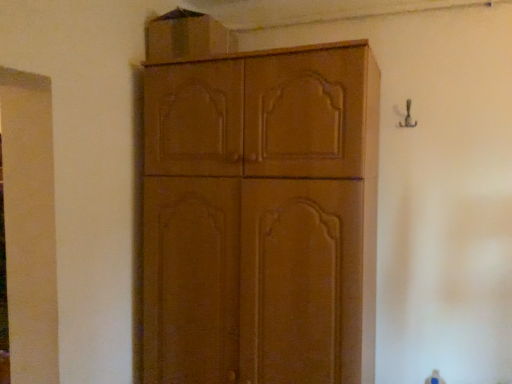
Question: In terms of height, does matte wood cabinet at center, the second cabinetry in the top-to-bottom sequence, look taller or shorter compared to matte brown cabinet at upper center, which is counted as the first cabinetry, starting from the top?

Choices:
 (A) tall
 (B) short

Answer: (A)

Question: Based on their sizes in the image, would you say matte wood cabinet at center, the second cabinetry in the top-to-bottom sequence, is bigger or smaller than matte brown cabinet at upper center, acting as the second cabinetry starting from the bottom?

Choices:
 (A) small
 (B) big

Answer: (B)

Question: From the image's perspective, is matte wood cabinet at center, the second cabinetry in the top-to-bottom sequence, positioned above or below matte brown cabinet at upper center, which is counted as the first cabinetry, starting from the top?

Choices:
 (A) below
 (B) above

Answer: (A)

Question: Is matte brown cabinet at upper center, acting as the second cabinetry starting from the bottom, to the left or to the right of matte wood cabinet at center, positioned as the 1th cabinetry in bottom-to-top order, in the image?

Choices:
 (A) right
 (B) left

Answer: (B)

Question: Considering the positions of matte brown cabinet at upper center, acting as the second cabinetry starting from the bottom, and matte wood cabinet at center, positioned as the 1th cabinetry in bottom-to-top order, in the image, is matte brown cabinet at upper center, acting as the second cabinetry starting from the bottom, wider or thinner than matte wood cabinet at center, positioned as the 1th cabinetry in bottom-to-top order,?

Choices:
 (A) thin
 (B) wide

Answer: (A)

Question: Is matte brown cabinet at upper center, acting as the second cabinetry starting from the bottom, taller or shorter than matte wood cabinet at center, the second cabinetry in the top-to-bottom sequence?

Choices:
 (A) tall
 (B) short

Answer: (B)

Question: From a real-world perspective, is matte brown cabinet at upper center, which is counted as the first cabinetry, starting from the top, above or below matte wood cabinet at center, positioned as the 1th cabinetry in bottom-to-top order?

Choices:
 (A) below
 (B) above

Answer: (B)